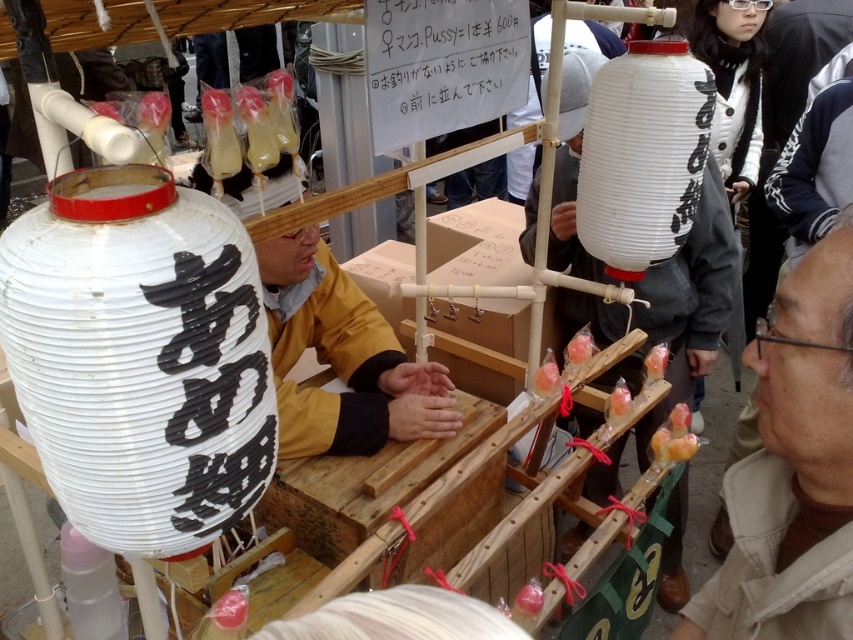
Which of these two, white paper lantern at upper center or white paper sign at upper center, stands taller?

Standing taller between the two is white paper lantern at upper center.

Is point (616, 273) less distant than point (492, 19)?

No.

Is point (596, 234) positioned behind point (463, 93)?

That is True.

Find the location of a particular element. white paper lantern at upper center is located at coordinates (643, 156).

Can you confirm if white paper lantern at left is positioned below white paper lantern at upper center?

Correct, white paper lantern at left is located below white paper lantern at upper center.

Describe the element at coordinates (138, 356) in the screenshot. Image resolution: width=853 pixels, height=640 pixels. I see `white paper lantern at left` at that location.

You are a GUI agent. You are given a task and a screenshot of the screen. Output one action in this format:
    pyautogui.click(x=<x>, y=<y>)
    Task: Click on the white paper lantern at left
    This screenshot has height=640, width=853.
    Given the screenshot: What is the action you would take?
    pyautogui.click(x=138, y=356)

Does white paper lantern at left appear over white paper sign at upper center?

Incorrect, white paper lantern at left is not positioned above white paper sign at upper center.

Can you confirm if white paper lantern at left is taller than white paper sign at upper center?

Yes, white paper lantern at left is taller than white paper sign at upper center.

What do you see at coordinates (138, 356) in the screenshot?
I see `white paper lantern at left` at bounding box center [138, 356].

Find the location of `white paper lantern at left`. white paper lantern at left is located at coordinates (138, 356).